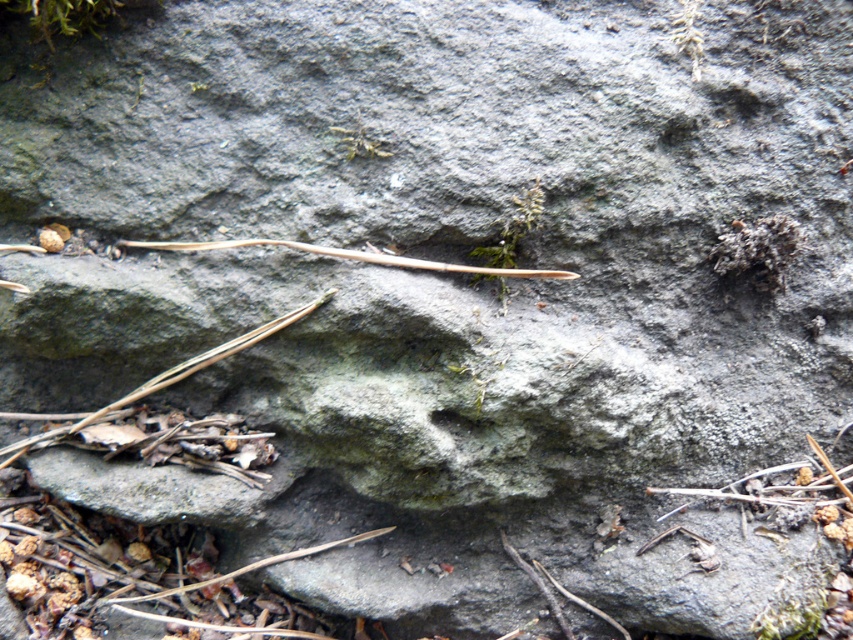
Question: Which point is farther from the camera taking this photo?

Choices:
 (A) 125,403
 (B) 303,250

Answer: (A)

Question: Considering the relative positions of brown wood twig at center and brown/dry wood twig at lower left in the image provided, where is brown wood twig at center located with respect to brown/dry wood twig at lower left?

Choices:
 (A) right
 (B) left

Answer: (A)

Question: Is brown wood twig at center bigger than brown/dry wood twig at lower left?

Choices:
 (A) no
 (B) yes

Answer: (A)

Question: Can you confirm if brown wood twig at center is positioned to the right of brown/dry wood twig at lower left?

Choices:
 (A) yes
 (B) no

Answer: (A)